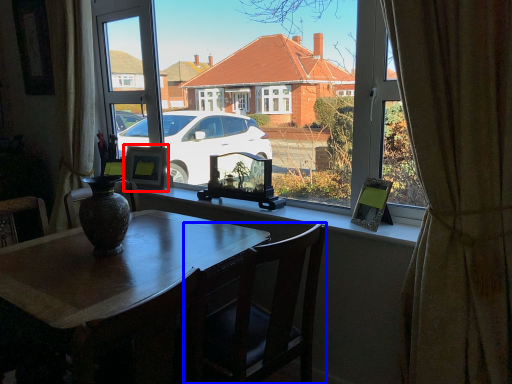
Question: Which object is further to the camera taking this photo, picture frame (highlighted by a red box) or chair (highlighted by a blue box)?

Choices:
 (A) picture frame
 (B) chair

Answer: (A)